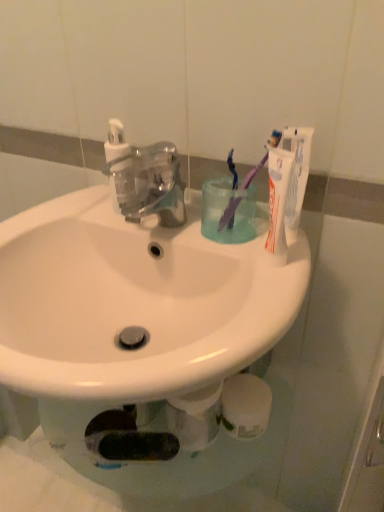
Find the location of a particular element. The width and height of the screenshot is (384, 512). vacant area that lies between transparent plastic faucet at center and translucent plastic cup at center is located at coordinates (203, 237).